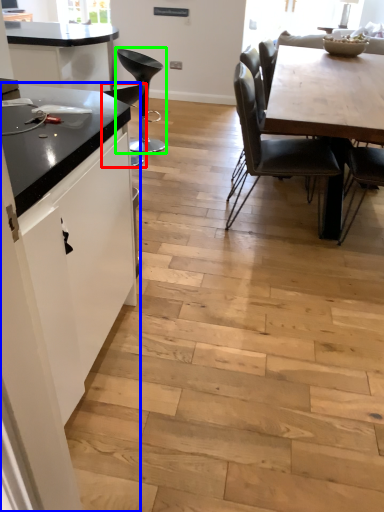
Question: Which is farther away from chair (highlighted by a red box)? cabinetry (highlighted by a blue box) or chair (highlighted by a green box)?

Choices:
 (A) cabinetry
 (B) chair

Answer: (A)